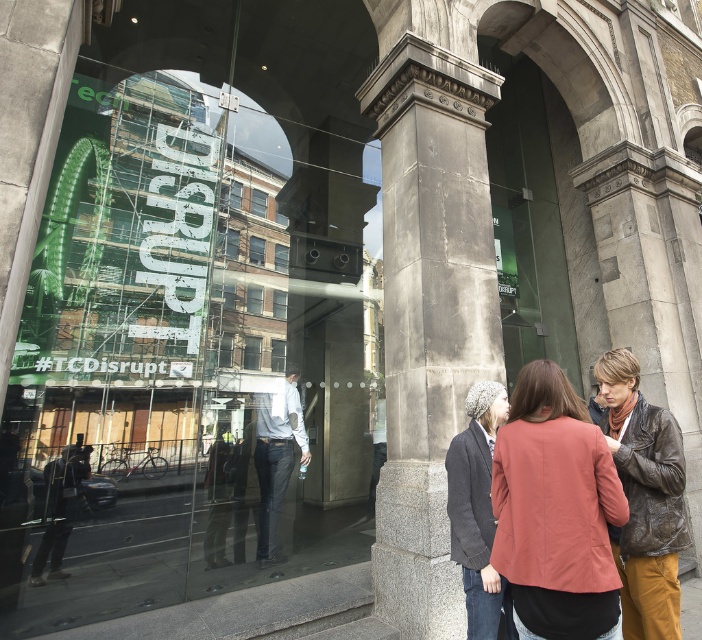
This screenshot has width=702, height=640. Describe the element at coordinates (430, 314) in the screenshot. I see `gray stone column at center` at that location.

Is point (399, 440) positioned in front of point (630, 410)?

No.

Is point (423, 305) closer to viewer compared to point (675, 484)?

That is False.

Locate an element on the screen. The height and width of the screenshot is (640, 702). gray stone column at center is located at coordinates (430, 314).

Does transparent glass window at center have a greater width compared to leather jacket at center?

Yes, transparent glass window at center is wider than leather jacket at center.

Between transparent glass window at center and leather jacket at center, which one has more height?

transparent glass window at center is taller.

Is point (125, 340) less distant than point (635, 637)?

No, (125, 340) is further to viewer.

This screenshot has width=702, height=640. I want to click on transparent glass window at center, so click(157, 374).

Is gray stone column at center closer to camera compared to gray woolen beanie at center?

No, gray stone column at center is further to the viewer.

Is gray stone column at center wider than gray woolen beanie at center?

Yes.

What do you see at coordinates (430, 314) in the screenshot? I see `gray stone column at center` at bounding box center [430, 314].

The image size is (702, 640). I want to click on gray stone column at center, so click(430, 314).